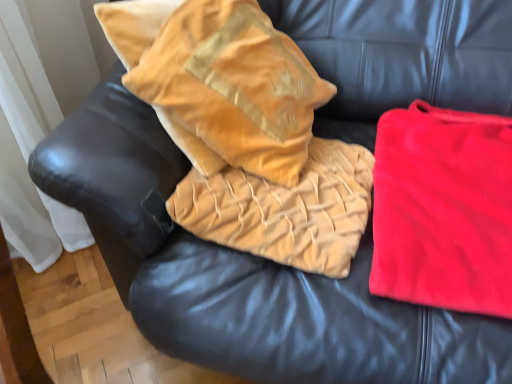
Question: Is point (395, 208) positioned closer to the camera than point (211, 44)?

Choices:
 (A) farther
 (B) closer

Answer: (B)

Question: Would you say red velvet blanket at right is to the left or to the right of velvet gold throw pillow at upper left in the picture?

Choices:
 (A) right
 (B) left

Answer: (A)

Question: Which is nearer to the red velvet blanket at right?

Choices:
 (A) velvet gold pillow at center
 (B) velvet gold throw pillow at upper left

Answer: (A)

Question: Estimate the real-world distances between objects in this image. Which object is farther from the velvet gold pillow at center?

Choices:
 (A) velvet gold throw pillow at upper left
 (B) red velvet blanket at right

Answer: (B)